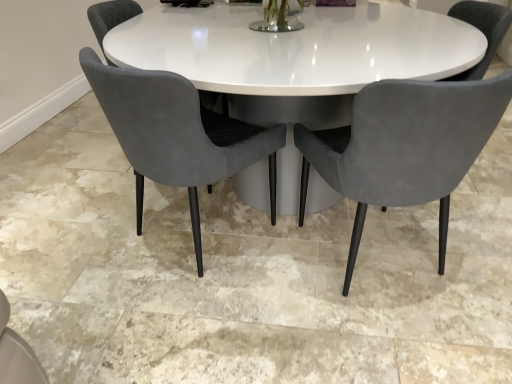
Image resolution: width=512 pixels, height=384 pixels. Identify the location of free location to the left of velvet grey chair at center, which is counted as the 1th chair, starting from the right. (257, 296).